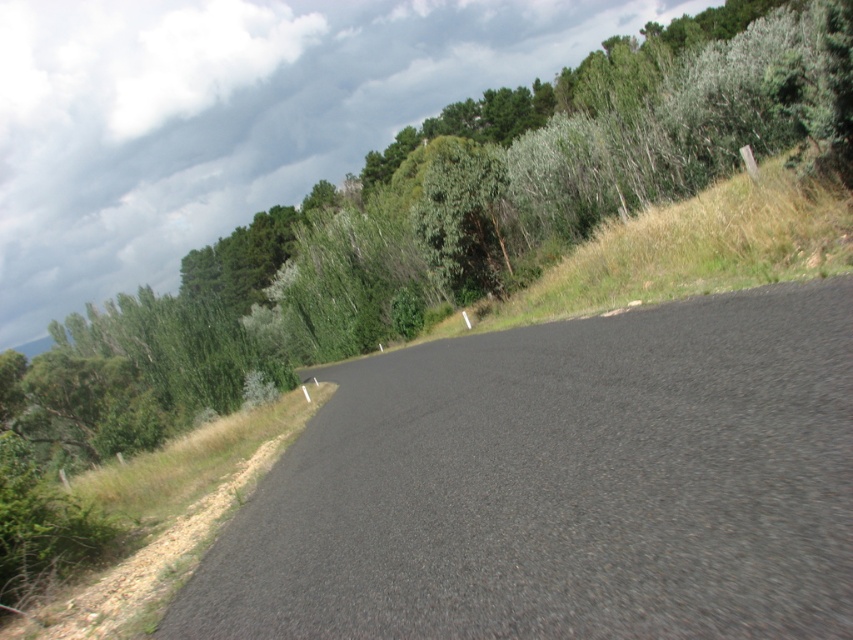
You are standing on the black asphalt road at center and want to look up at the green leafy tree at upper left. Based on their heights, will you have to tilt your head upwards significantly to see the top of the tree?

The black asphalt road at center is not as tall as green leafy tree at upper left, so yes, you will have to tilt your head upwards significantly to see the top of the green leafy tree at upper left.

You are standing at the starting point of the road in the image. If you walk straight ahead along the black asphalt road at center, in which direction will the road curve?

The road curves to the right as it stretches into the distance.

You are standing at the starting point of the road and want to reach a point marked by coordinates. Which of the two points, point (567, 460) or point (146, 404), is closer to you?

Point (567, 460) is closer to the camera than point (146, 404), so it is closer to you.